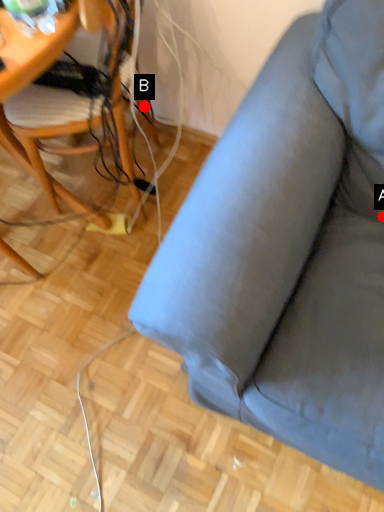
Question: Two points are circled on the image, labeled by A and B beside each circle. Which point is closer to the camera?

Choices:
 (A) A is closer
 (B) B is closer

Answer: (A)